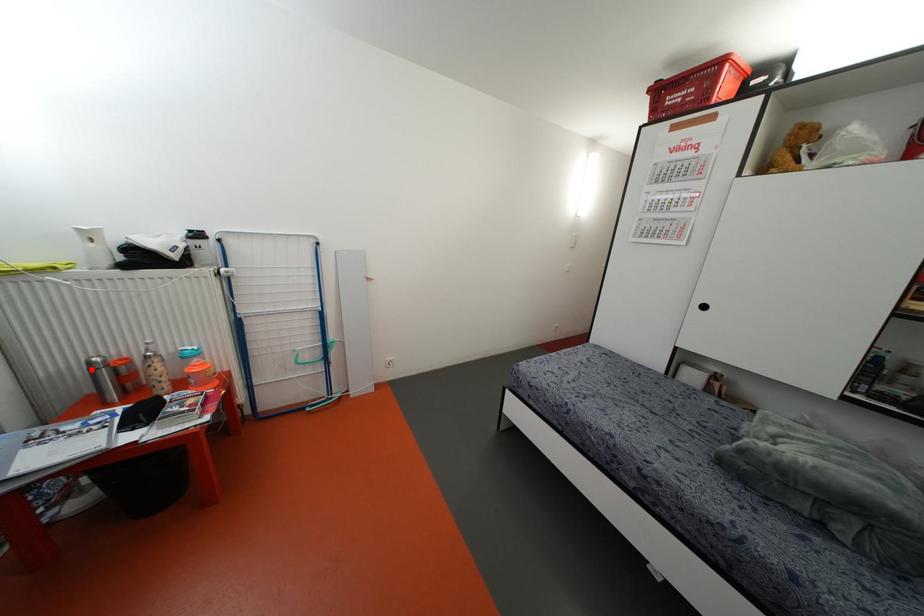
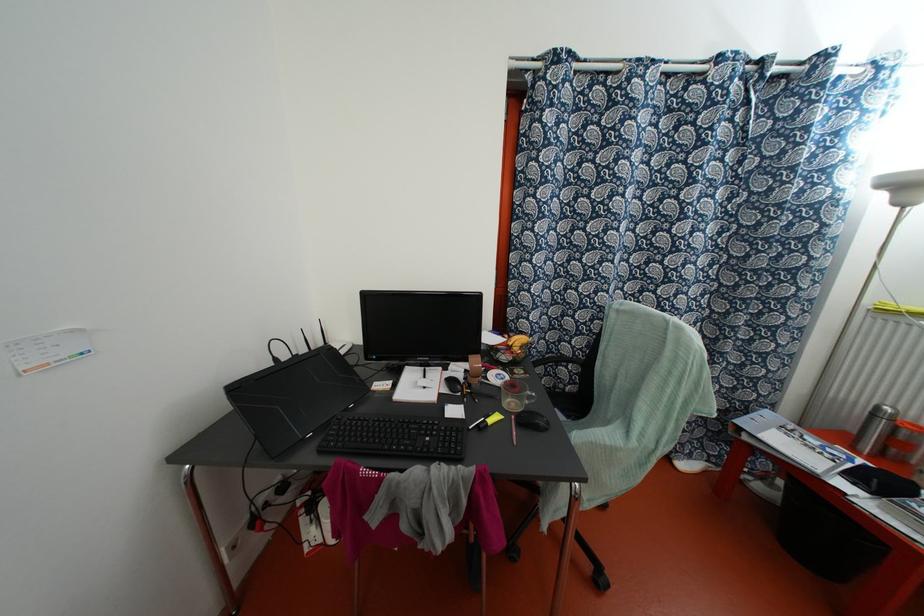
Question: A red point is marked in image1. In image2, is the corresponding 3D point closer to the camera or farther? Reply with the corresponding letter.

Choices:
 (A) The corresponding 3D point is closer.
 (B) The corresponding 3D point is farther.

Answer: (B)